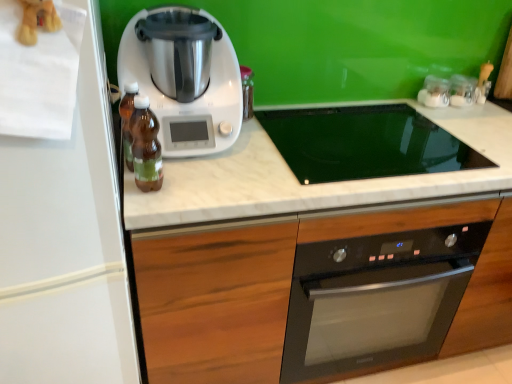
Measure the distance between point (140, 161) and camera.

38.94 inches.

The height and width of the screenshot is (384, 512). Describe the element at coordinates (145, 146) in the screenshot. I see `brown glass bottle at center, marked as the second bottle in a back-to-front arrangement` at that location.

Measure the distance between point (x=124, y=73) and camera.

They are 3.65 feet apart.

Image resolution: width=512 pixels, height=384 pixels. Describe the element at coordinates (311, 184) in the screenshot. I see `white marble countertop at center` at that location.

This screenshot has width=512, height=384. In order to click on clear glass jars at upper right, marked as the first appliance in a right-to-left arrangement in this screenshot , I will do `click(462, 90)`.

The height and width of the screenshot is (384, 512). What do you see at coordinates (66, 245) in the screenshot?
I see `white matte refrigerator at left` at bounding box center [66, 245].

What do you see at coordinates (312, 281) in the screenshot? I see `wooden cabinet at center` at bounding box center [312, 281].

You are a GUI agent. You are given a task and a screenshot of the screen. Output one action in this format:
    pyautogui.click(x=<x>, y=<y>)
    Task: Click on the brown glass bottle at center, marked as the second bottle in a back-to-front arrangement
    
    Given the screenshot: What is the action you would take?
    pyautogui.click(x=145, y=146)

Measure the distance between clear glass jars at upper right, which appears as the first appliance when viewed from the left, and wooden cabinet at center.

The distance of clear glass jars at upper right, which appears as the first appliance when viewed from the left, from wooden cabinet at center is 32.76 inches.

This screenshot has height=384, width=512. I want to click on cabinetry that is on the left side of clear glass jars at upper right, the 2th appliance when ordered from right to left, so click(x=312, y=281).

Would you say clear glass jars at upper right, which appears as the first appliance when viewed from the left, contains wooden cabinet at center?

No, wooden cabinet at center is not inside clear glass jars at upper right, which appears as the first appliance when viewed from the left.

Who is taller, clear glass jars at upper right, the 2th appliance when ordered from right to left, or wooden cabinet at center?

With more height is wooden cabinet at center.

Is white marble countertop at center inside the boundaries of white plastic kitchen appliance at center, or outside?

white marble countertop at center is not inside white plastic kitchen appliance at center, it's outside.

In terms of width, does white marble countertop at center look wider or thinner when compared to white plastic kitchen appliance at center?

In the image, white marble countertop at center appears to be wider than white plastic kitchen appliance at center.

Are white marble countertop at center and white plastic kitchen appliance at center located far from each other?

white marble countertop at center is near white plastic kitchen appliance at center, not far away.

Consider the image. Who is smaller, white marble countertop at center or white plastic kitchen appliance at center?

white plastic kitchen appliance at center is smaller.

From the image's perspective, is brown glass bottle at left, which is the 1th bottle in back-to-front order, on clear glass jars at upper right, which ranks as the second appliance in left-to-right order?

No, from the image's perspective, brown glass bottle at left, which is the 1th bottle in back-to-front order, is not over clear glass jars at upper right, which ranks as the second appliance in left-to-right order.

Where is `appliance that is the 1st object directly below the brown glass bottle at left, which is the 1th bottle in back-to-front order (from a real-world perspective)`? The image size is (512, 384). appliance that is the 1st object directly below the brown glass bottle at left, which is the 1th bottle in back-to-front order (from a real-world perspective) is located at coordinates (462, 90).

From a real-world perspective, between brown glass bottle at left, which is the 1th bottle in back-to-front order, and clear glass jars at upper right, marked as the first appliance in a right-to-left arrangement, who is vertically lower?

clear glass jars at upper right, marked as the first appliance in a right-to-left arrangement.

Does brown glass bottle at left, which is the 1th bottle in back-to-front order, have a lesser height compared to clear glass jars at upper right, marked as the first appliance in a right-to-left arrangement?

Incorrect, the height of brown glass bottle at left, which is the 1th bottle in back-to-front order, does not fall short of that of clear glass jars at upper right, marked as the first appliance in a right-to-left arrangement.

Who is taller, wooden cabinet at center or clear glass jars at upper right, which ranks as the second appliance in left-to-right order?

Standing taller between the two is wooden cabinet at center.

Is wooden cabinet at center inside or outside of clear glass jars at upper right, which ranks as the second appliance in left-to-right order?

wooden cabinet at center is located beyond the bounds of clear glass jars at upper right, which ranks as the second appliance in left-to-right order.

How far apart are wooden cabinet at center and clear glass jars at upper right, which ranks as the second appliance in left-to-right order?

They are 34.03 inches apart.

From a real-world perspective, between wooden cabinet at center and clear glass jars at upper right, marked as the first appliance in a right-to-left arrangement, who is vertically lower?

wooden cabinet at center.

In terms of width, does white matte refrigerator at left look wider or thinner when compared to clear glass jars at upper right, which ranks as the second appliance in left-to-right order?

Considering their sizes, white matte refrigerator at left looks broader than clear glass jars at upper right, which ranks as the second appliance in left-to-right order.

Is white matte refrigerator at left further to camera compared to clear glass jars at upper right, which ranks as the second appliance in left-to-right order?

No, it is in front of clear glass jars at upper right, which ranks as the second appliance in left-to-right order.

Would you say white matte refrigerator at left is a long distance from clear glass jars at upper right, which ranks as the second appliance in left-to-right order?

That's right, there is a large distance between white matte refrigerator at left and clear glass jars at upper right, which ranks as the second appliance in left-to-right order.

From a real-world perspective, starting from the white matte refrigerator at left, which appliance is the 2nd one vertically above it? Please provide its 2D coordinates.

[(462, 90)]

From the image's perspective, is brown glass bottle at center, marked as the second bottle in a back-to-front arrangement, above or below white plastic kitchen appliance at center?

From the image's perspective, brown glass bottle at center, marked as the second bottle in a back-to-front arrangement, appears below white plastic kitchen appliance at center.

From a real-world perspective, relative to white plastic kitchen appliance at center, is brown glass bottle at center, marked as the second bottle in a back-to-front arrangement, vertically above or below?

brown glass bottle at center, marked as the second bottle in a back-to-front arrangement, is situated lower than white plastic kitchen appliance at center in the real world.

Is brown glass bottle at center, marked as the second bottle in a back-to-front arrangement, wider or thinner than white plastic kitchen appliance at center?

Considering their sizes, brown glass bottle at center, marked as the second bottle in a back-to-front arrangement, looks slimmer than white plastic kitchen appliance at center.

Is the surface of brown glass bottle at center, the first bottle when ordered from front to back, in direct contact with white plastic kitchen appliance at center?

brown glass bottle at center, the first bottle when ordered from front to back, and white plastic kitchen appliance at center are clearly separated.

From a real-world perspective, is white plastic kitchen appliance at center on clear glass jars at upper right, marked as the first appliance in a right-to-left arrangement?

Correct, in the physical world, white plastic kitchen appliance at center is higher than clear glass jars at upper right, marked as the first appliance in a right-to-left arrangement.

This screenshot has width=512, height=384. I want to click on home appliance below the clear glass jars at upper right, marked as the first appliance in a right-to-left arrangement (from the image's perspective), so click(184, 78).

Is point (186, 64) farther from viewer compared to point (450, 99)?

No, (186, 64) is in front of (450, 99).

You are a GUI agent. You are given a task and a screenshot of the screen. Output one action in this format:
    pyautogui.click(x=<x>, y=<y>)
    Task: Click on the 1st appliance behind when counting from the wooden cabinet at center
    The image size is (512, 384).
    Given the screenshot: What is the action you would take?
    pyautogui.click(x=434, y=92)

Locate an element on the screen. home appliance in front of the white marble countertop at center is located at coordinates (184, 78).

When comparing their distances from brown glass bottle at left, positioned as the 2th bottle in front-to-back order, does white marble countertop at center or wooden cabinet at center seem further?

wooden cabinet at center is positioned further to the anchor brown glass bottle at left, positioned as the 2th bottle in front-to-back order.

In the scene shown: Based on their spatial positions, is clear glass jars at upper right, which appears as the first appliance when viewed from the left, or brown glass bottle at center, the first bottle when ordered from front to back, further from white plastic kitchen appliance at center?

clear glass jars at upper right, which appears as the first appliance when viewed from the left, is positioned further to the anchor white plastic kitchen appliance at center.

Looking at the image, which one is located closer to wooden cabinet at center, clear glass jars at upper right, the 2th appliance when ordered from right to left, or white plastic kitchen appliance at center?

The object closer to wooden cabinet at center is white plastic kitchen appliance at center.

When comparing their distances from brown glass bottle at center, the first bottle when ordered from front to back, does clear glass jars at upper right, which appears as the first appliance when viewed from the left, or clear glass jars at upper right, marked as the first appliance in a right-to-left arrangement, seem closer?

Among the two, clear glass jars at upper right, which appears as the first appliance when viewed from the left, is located nearer to brown glass bottle at center, the first bottle when ordered from front to back.

Which object lies further to the anchor point clear glass jars at upper right, which ranks as the second appliance in left-to-right order, brown glass bottle at center, marked as the second bottle in a back-to-front arrangement, or white plastic kitchen appliance at center?

brown glass bottle at center, marked as the second bottle in a back-to-front arrangement, lies further to clear glass jars at upper right, which ranks as the second appliance in left-to-right order, than the other object.

Which object lies nearer to the anchor point brown glass bottle at center, the first bottle when ordered from front to back, white plastic kitchen appliance at center or wooden cabinet at center?

white plastic kitchen appliance at center lies closer to brown glass bottle at center, the first bottle when ordered from front to back, than the other object.

Based on their spatial positions, is wooden cabinet at center or brown glass bottle at left, which is the 1th bottle in back-to-front order, closer to white matte refrigerator at left?

The object closer to white matte refrigerator at left is brown glass bottle at left, which is the 1th bottle in back-to-front order.

Looking at the image, which one is located further to brown glass bottle at left, which is the 1th bottle in back-to-front order, white matte refrigerator at left or clear glass jars at upper right, the 2th appliance when ordered from right to left?

Based on the image, clear glass jars at upper right, the 2th appliance when ordered from right to left, appears to be further to brown glass bottle at left, which is the 1th bottle in back-to-front order.

Locate an element on the screen. The width and height of the screenshot is (512, 384). home appliance between brown glass bottle at center, marked as the second bottle in a back-to-front arrangement, and wooden cabinet at center from left to right is located at coordinates (184, 78).

Locate an element on the screen. This screenshot has height=384, width=512. cabinetry between white plastic kitchen appliance at center and clear glass jars at upper right, which appears as the first appliance when viewed from the left, in the horizontal direction is located at coordinates (312, 281).

Where is `bottle between white plastic kitchen appliance at center and brown glass bottle at center, the first bottle when ordered from front to back, from top to bottom`? bottle between white plastic kitchen appliance at center and brown glass bottle at center, the first bottle when ordered from front to back, from top to bottom is located at coordinates (128, 120).

The image size is (512, 384). What are the coordinates of `cabinetry between white matte refrigerator at left and clear glass jars at upper right, the 2th appliance when ordered from right to left, in the horizontal direction` in the screenshot? It's located at (312, 281).